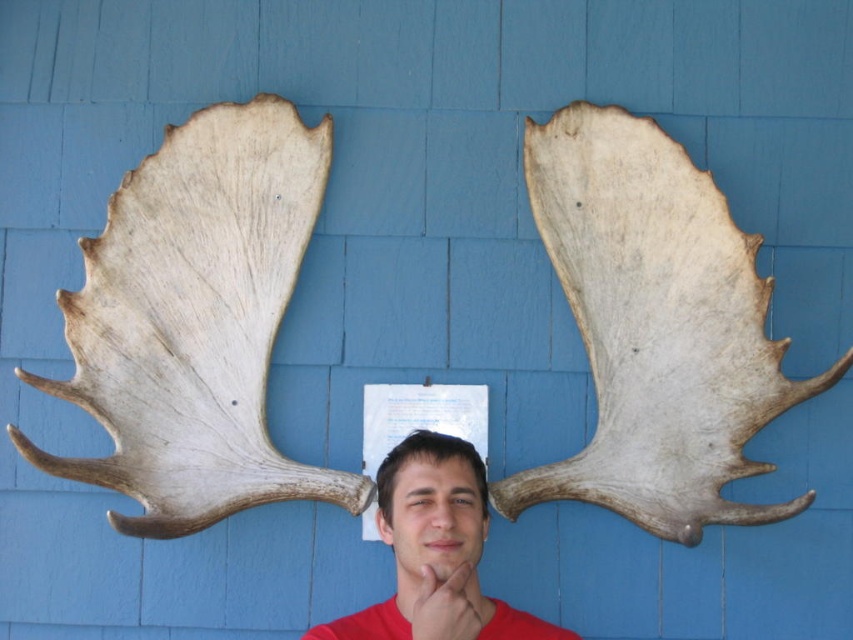
You are standing in front of the blue wooden wall and want to touch one of the two points on the wall. Which point is closer to you, point (419, 609) or point (444, 563)?

Point (419, 609) is closer to the viewer than point (444, 563).

In the scene shown: You are a photographer adjusting the lighting for a portrait. You need to ensure that the matte brown hair at center and the matte skin at center are both well illuminated. Which object should you focus the light on first to ensure the one that is higher up is properly lit?

The matte brown hair at center is taller than the matte skin at center, so you should focus the light on the matte brown hair at center first to ensure proper illumination of the higher object.

You are a photographer adjusting the lighting for a portrait. You notice the matte brown hair at center and the matte skin at center. Which object is located to the right of the other?

The matte brown hair at center is positioned on the right side of matte skin at center.